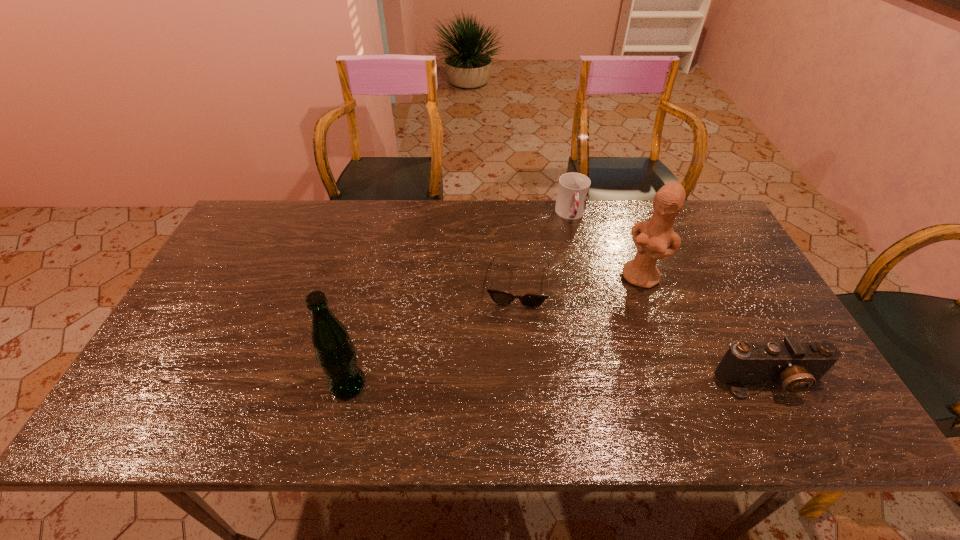
At what (x,y) coordinates should I click in order to perform the action: click on vacant space on the desktop that is between the beer bottle and the camera and is positioned on the front-facing side of the figurine. Please return your answer as a coordinate pair (x, y). Image resolution: width=960 pixels, height=540 pixels. Looking at the image, I should click on (576, 383).

This screenshot has width=960, height=540. In order to click on vacant space on the desktop that is between the leftmost object and the camera and is positioned on the handle side of the farthest object in this screenshot , I will do `click(602, 383)`.

Where is `vacant spot on the desktop that is between the leftmost object and the rightmost object and is positioned on the front lenses of the fourth object from right to left`? This screenshot has height=540, width=960. vacant spot on the desktop that is between the leftmost object and the rightmost object and is positioned on the front lenses of the fourth object from right to left is located at coordinates (508, 384).